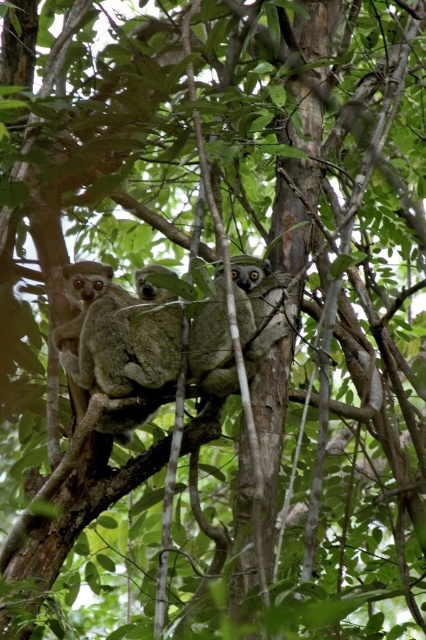
Who is higher up, soft brown fur at left or gray furry koala at center?

gray furry koala at center is higher up.

Does soft brown fur at left have a greater width compared to gray furry koala at center?

Yes, soft brown fur at left is wider than gray furry koala at center.

Where is `soft brown fur at left`? The width and height of the screenshot is (426, 640). soft brown fur at left is located at coordinates (118, 332).